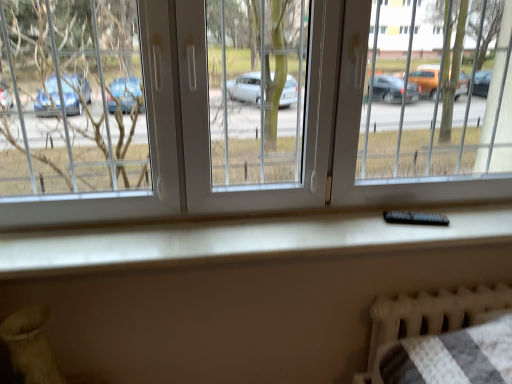
Question: Considering the positions of point (432, 223) and point (374, 349), is point (432, 223) closer or farther from the camera than point (374, 349)?

Choices:
 (A) farther
 (B) closer

Answer: (B)

Question: Looking at their shapes, would you say black plastic remote at center is wider or thinner than white textured radiator at lower right?

Choices:
 (A) wide
 (B) thin

Answer: (B)

Question: Considering the real-world distances, which object is closest to the white textured radiator at lower right?

Choices:
 (A) transparent plastic window at center
 (B) black plastic remote at center

Answer: (B)

Question: Based on their relative distances, which object is nearer to the black plastic remote at center?

Choices:
 (A) white textured radiator at lower right
 (B) transparent plastic window at center

Answer: (A)